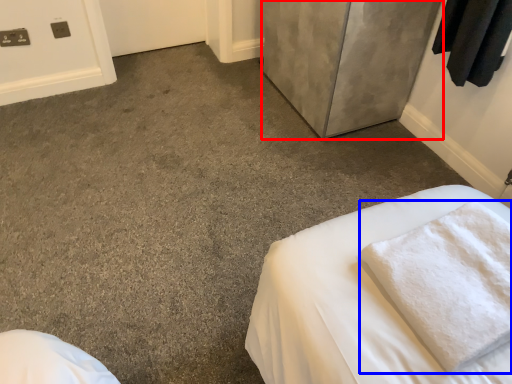
Question: Which object is closer to the camera taking this photo, door (highlighted by a red box) or bath towel (highlighted by a blue box)?

Choices:
 (A) door
 (B) bath towel

Answer: (B)